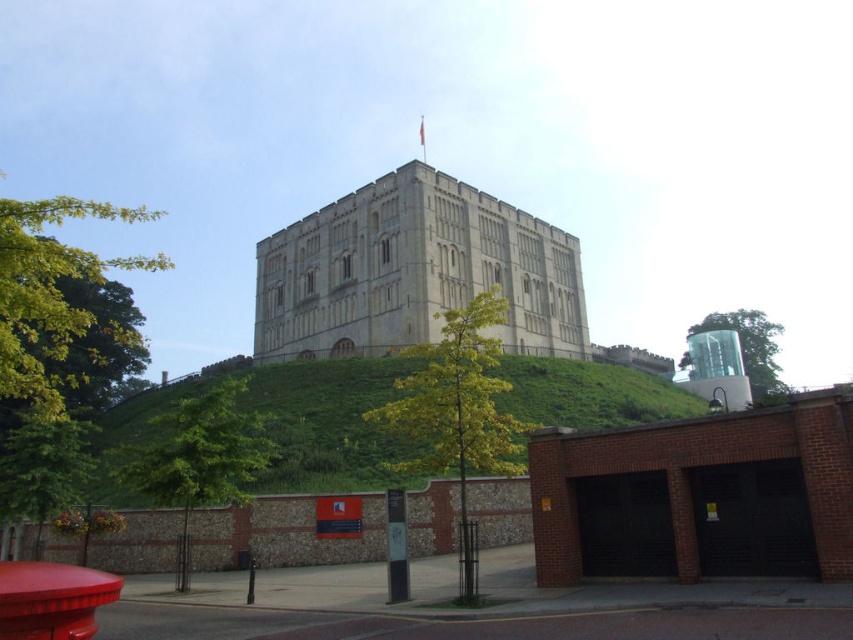
You are standing in front of the historic stone building and want to walk towards the transparent glass tree at upper right. Which direction should you move relative to the green grassy hillside at upper center?

You should move upwards relative to the green grassy hillside at upper center because the transparent glass tree at upper right is located above it.

You are standing in front of a historic site and see the beige stone castle at center and the green grassy hillside at upper center. Which object is positioned to the left of the other?

The beige stone castle at center is to the left of the green grassy hillside at upper center.

You are standing at the base of the hill looking up at the beige stone castle at center and the green grassy hillside at upper center. Which object is higher in elevation?

The beige stone castle at center is higher in elevation than the green grassy hillside at upper center because it is positioned above it.